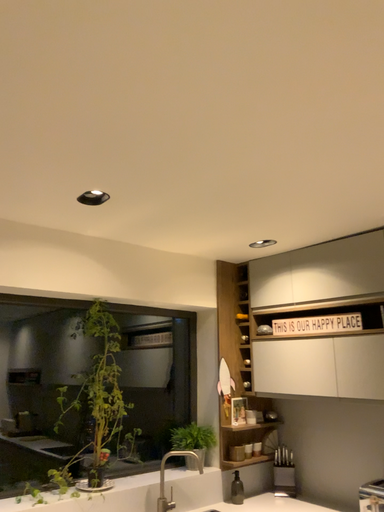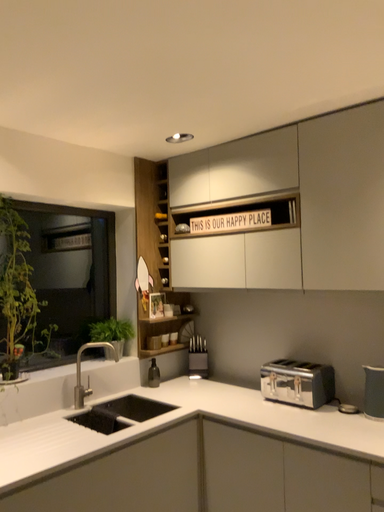
Question: Which way did the camera rotate in the video?

Choices:
 (A) rotated right
 (B) rotated left

Answer: (A)